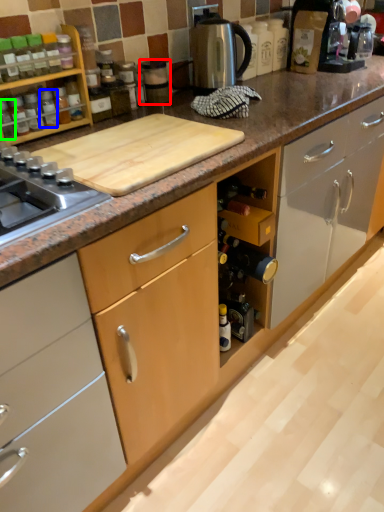
Question: Which is nearer to the appliance (highlighted by a red box)? bottle (highlighted by a blue box) or bottle (highlighted by a green box).

Choices:
 (A) bottle
 (B) bottle

Answer: (A)